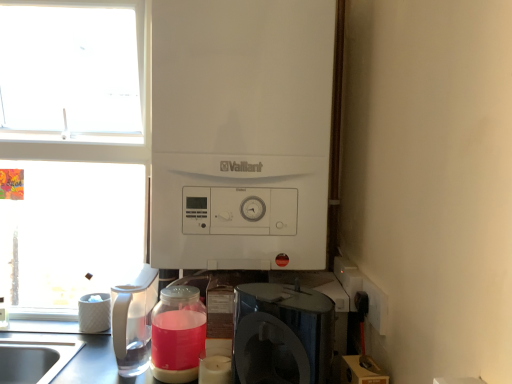
Question: Does satin black coffee maker at lower center have a smaller size compared to clear plastic pitcher at left?

Choices:
 (A) yes
 (B) no

Answer: (B)

Question: Is the depth of satin black coffee maker at lower center less than that of clear plastic pitcher at left?

Choices:
 (A) yes
 (B) no

Answer: (A)

Question: Is satin black coffee maker at lower center far from clear plastic pitcher at left?

Choices:
 (A) yes
 (B) no

Answer: (B)

Question: Is satin black coffee maker at lower center bigger than clear plastic pitcher at left?

Choices:
 (A) yes
 (B) no

Answer: (A)

Question: From the image's perspective, would you say satin black coffee maker at lower center is shown under clear plastic pitcher at left?

Choices:
 (A) yes
 (B) no

Answer: (A)

Question: From a real-world perspective, is satin black coffee maker at lower center positioned over clear plastic pitcher at left based on gravity?

Choices:
 (A) no
 (B) yes

Answer: (B)

Question: Is white matte boiler at center, which appears as the second appliance when viewed from the left, to the right of white matte window at upper left from the viewer's perspective?

Choices:
 (A) no
 (B) yes

Answer: (B)

Question: Is white matte boiler at center, the second appliance positioned from the back, not within white matte window at upper left?

Choices:
 (A) no
 (B) yes

Answer: (B)

Question: From a real-world perspective, is white matte boiler at center, the 1th appliance in the right-to-left sequence, positioned under white matte window at upper left based on gravity?

Choices:
 (A) no
 (B) yes

Answer: (A)

Question: Can you confirm if white matte boiler at center, the second appliance positioned from the back, is bigger than white matte window at upper left?

Choices:
 (A) no
 (B) yes

Answer: (A)

Question: Is white matte boiler at center, which is the 1th appliance from front to back, to the left of white matte window at upper left from the viewer's perspective?

Choices:
 (A) yes
 (B) no

Answer: (B)

Question: Does white matte boiler at center, the second appliance positioned from the back, turn towards satin black coffee maker at lower center?

Choices:
 (A) yes
 (B) no

Answer: (B)